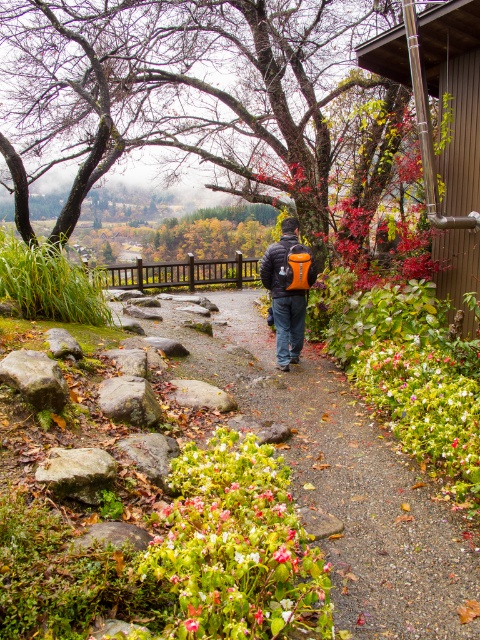
You are standing at the entrance of the garden and see the gravel path at center and the orange fabric backpack at center. Which object is closer to you?

The gravel path at center is closer to you because it is in front of the orange fabric backpack at center.

You are a hiker who wants to place your orange fabric backpack at center on the ground near the gravel path at center. Based on the scene, can you safely put it there?

The gravel path at center is below the orange fabric backpack at center, so placing the backpack on the path would be safe and within reach.

You are standing at the camera position and want to walk to both points in the image. Which point should you reach first, point (334, 435) or point (278, 257)?

Point (334, 435) is closer to the camera than point (278, 257), so you will reach point (334, 435) first.